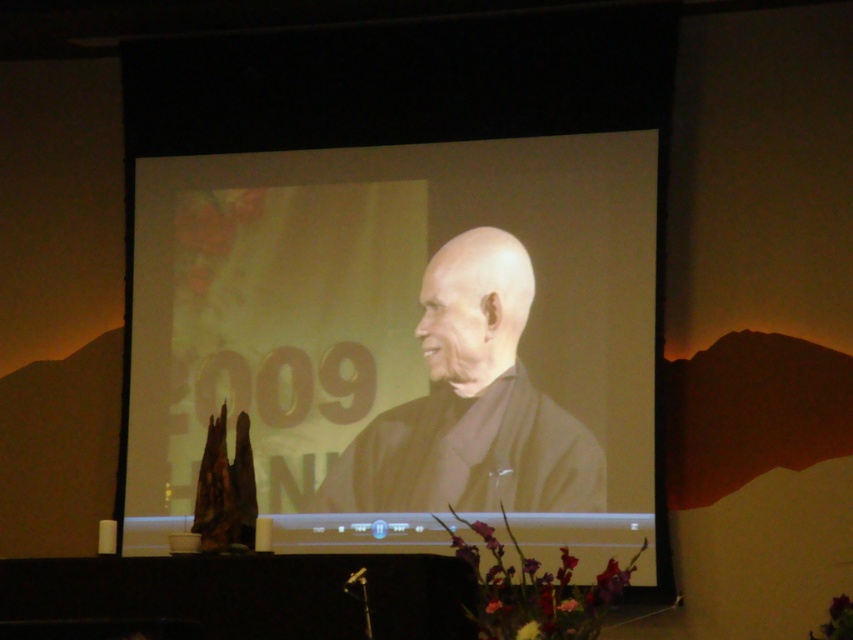
Question: Is matte black screen at center to the right of black matte kimono at center from the viewer's perspective?

Choices:
 (A) no
 (B) yes

Answer: (A)

Question: Among these points, which one is farthest from the camera?

Choices:
 (A) (587, 224)
 (B) (509, 284)

Answer: (A)

Question: Which object appears closest to the camera in this image?

Choices:
 (A) black matte kimono at center
 (B) matte black screen at center

Answer: (B)

Question: Which of the following is the closest to the observer?

Choices:
 (A) matte black screen at center
 (B) black matte kimono at center

Answer: (A)

Question: Does matte black screen at center come behind black matte kimono at center?

Choices:
 (A) yes
 (B) no

Answer: (B)

Question: From the image, what is the correct spatial relationship of matte black screen at center in relation to black matte kimono at center?

Choices:
 (A) above
 (B) below

Answer: (A)